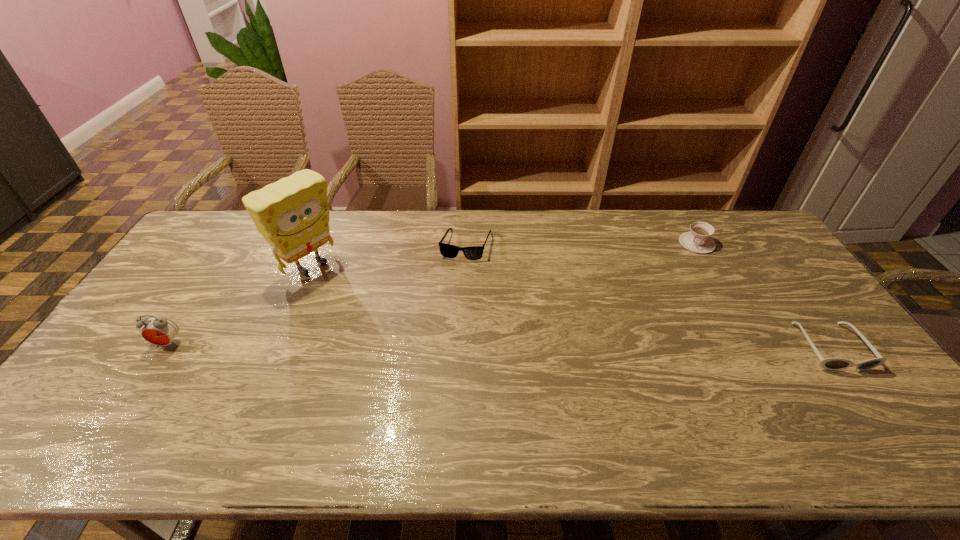
Identify the location of sunglasses present at the far edge. (449, 251).

Find the location of `sponge located at the far edge`. sponge located at the far edge is located at coordinates (292, 214).

I want to click on teacup at the far edge, so click(x=698, y=240).

Find the location of `object that is at the left edge`. object that is at the left edge is located at coordinates (x=159, y=331).

I want to click on object present at the right edge, so click(829, 363).

Where is `free point at the far edge`? The width and height of the screenshot is (960, 540). free point at the far edge is located at coordinates (391, 241).

The width and height of the screenshot is (960, 540). I want to click on vacant space at the near edge, so click(604, 387).

Locate an element on the screen. Image resolution: width=960 pixels, height=540 pixels. vacant space at the left edge of the desktop is located at coordinates (202, 256).

In the image, there is a desktop. Identify the location of vacant space at the far left corner. (233, 240).

Find the location of `free space between the farther sunglasses and the teacup`. free space between the farther sunglasses and the teacup is located at coordinates (582, 244).